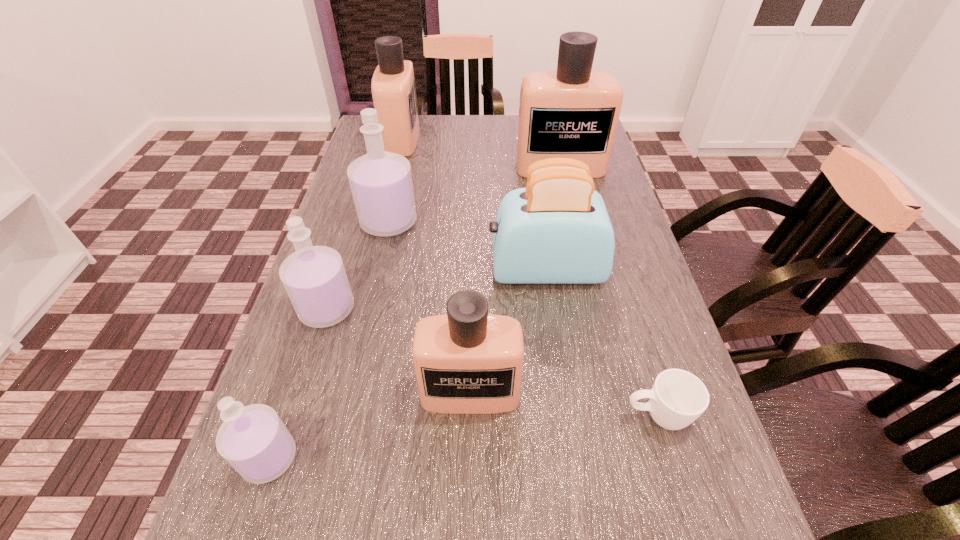
Identify the location of the nearest purple perfume. (253, 439).

I want to click on the smallest purple perfume, so click(x=253, y=439).

This screenshot has height=540, width=960. Find the location of `the shortest object`. the shortest object is located at coordinates point(678,398).

Locate an element on the screen. free space located on the front label of the biggest beige perfume is located at coordinates (574, 226).

You are a GUI agent. You are given a task and a screenshot of the screen. Output one action in this format:
    pyautogui.click(x=<x>, y=<y>)
    Task: Click on the vacant space located on the front label of the leftmost beige perfume
    The image size is (960, 540).
    Given the screenshot: What is the action you would take?
    pyautogui.click(x=505, y=139)

Where is `vacant region located 0.050m on the back of the biggest purple perfume`? This screenshot has width=960, height=540. vacant region located 0.050m on the back of the biggest purple perfume is located at coordinates (396, 194).

Locate an element on the screen. free space located 0.320m on the side of the toaster with the lever is located at coordinates (349, 270).

Image resolution: width=960 pixels, height=540 pixels. I want to click on free space located 0.210m on the side of the toaster with the lever, so click(x=397, y=270).

The width and height of the screenshot is (960, 540). I want to click on vacant space located 0.220m on the side of the toaster with the lever, so click(x=393, y=270).

Find the location of a particular element. free spot located 0.320m on the right of the fourth farthest perfume is located at coordinates (506, 309).